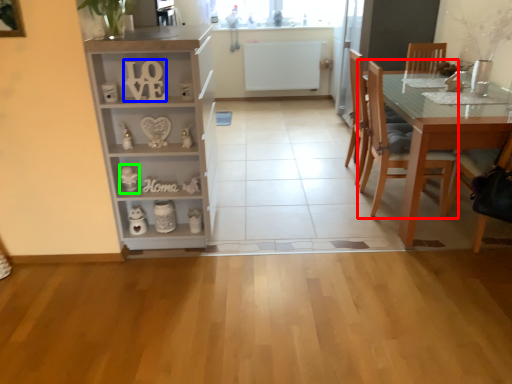
Question: Which is farther away from chair (highlighted by a red box)? number (highlighted by a blue box) or toy (highlighted by a green box)?

Choices:
 (A) number
 (B) toy

Answer: (B)